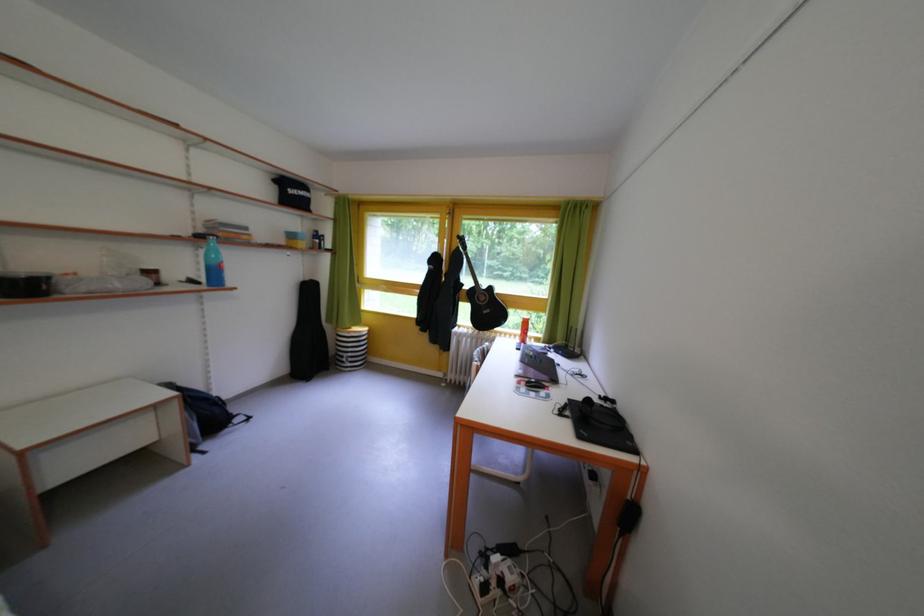
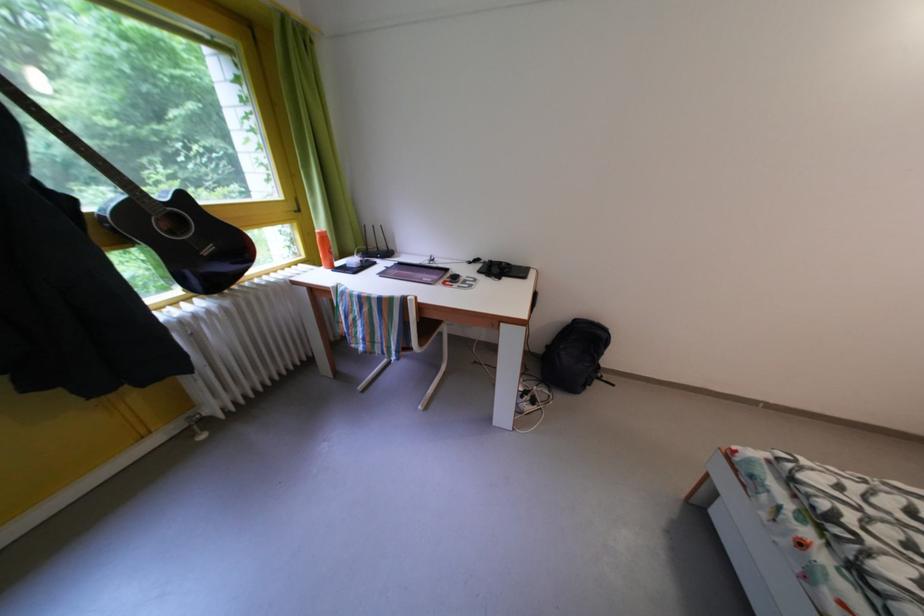
In the second image, find the point that corresponds to (x=533, y=323) in the first image.

(329, 238)